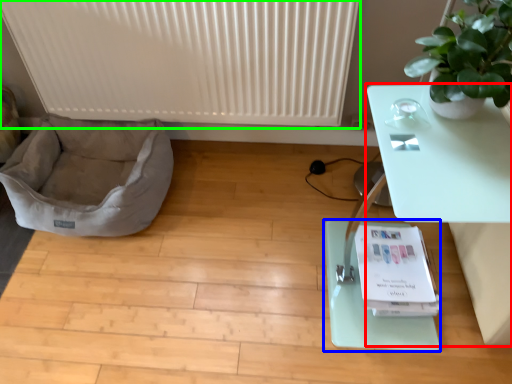
Question: Based on their relative distances, which object is nearer to table (highlighted by a red box)? Choose from yoga mat (highlighted by a blue box) and radiator (highlighted by a green box).

Choices:
 (A) yoga mat
 (B) radiator

Answer: (A)